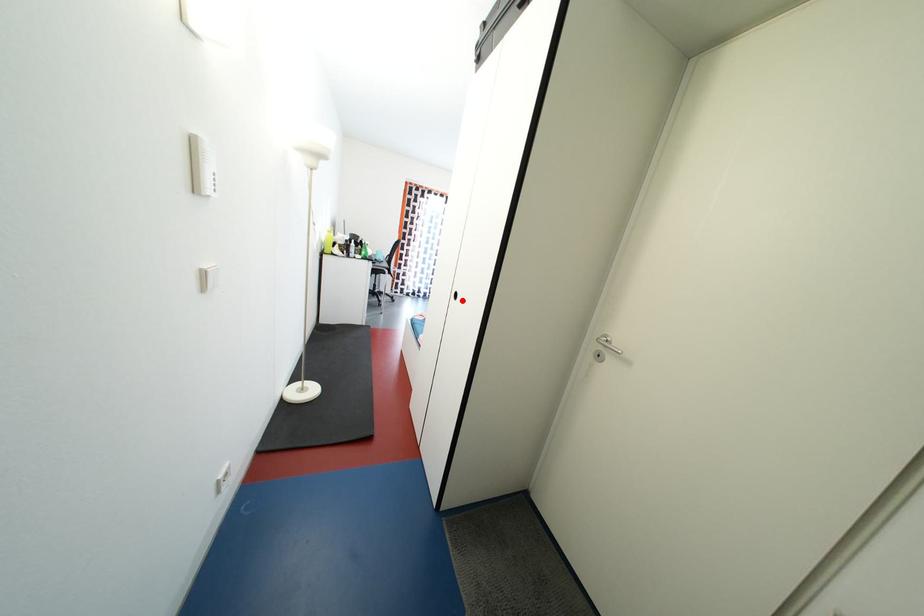
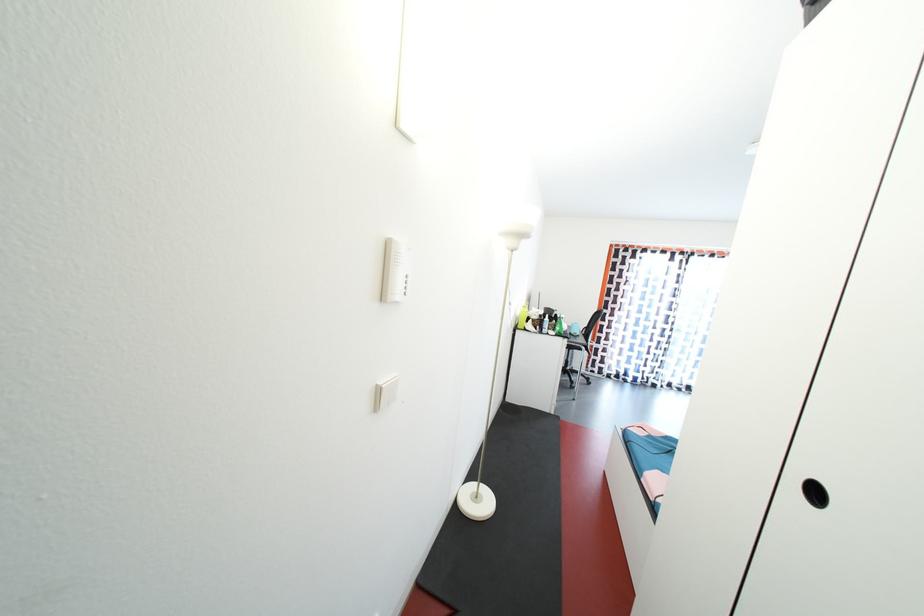
The point at the highlighted location is marked in the first image. Where is the corresponding point in the second image?

(821, 498)